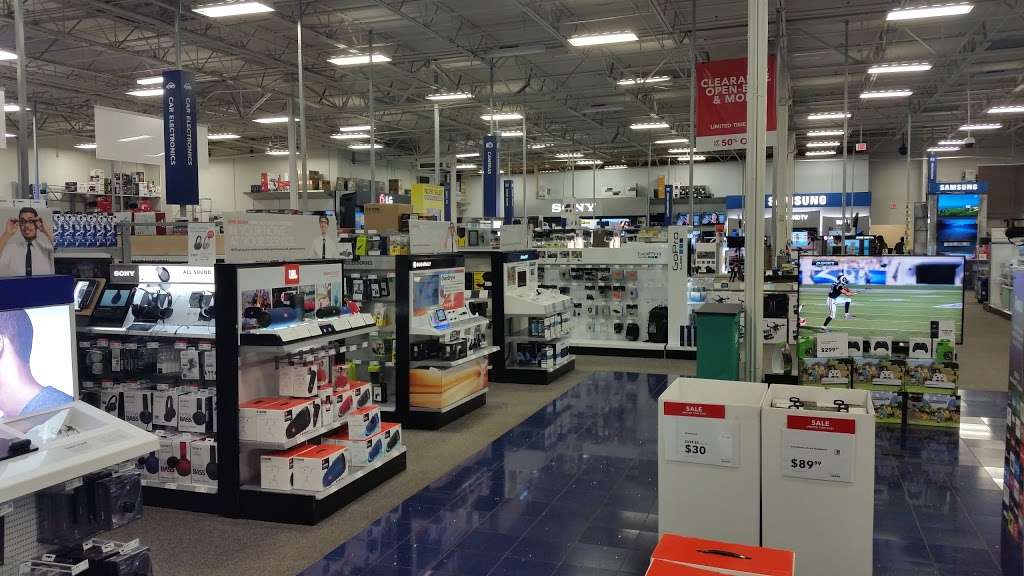
At what (x,y) coordinates should I click in order to perform the action: click on tvs. Please return your answer as a coordinate pair (x, y). The width and height of the screenshot is (1024, 576). Looking at the image, I should click on (891, 304), (622, 218), (961, 200).